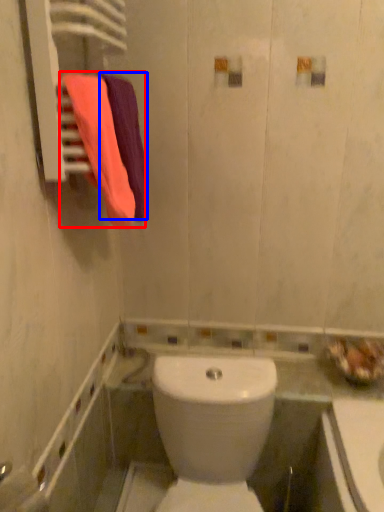
Question: Which of the following is the closest to the observer, bath towel (highlighted by a red box) or bath towel (highlighted by a blue box)?

Choices:
 (A) bath towel
 (B) bath towel

Answer: (A)